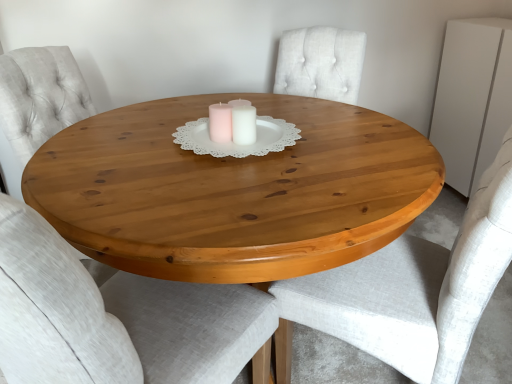
Where is `free space in front of white matte candle at center`? free space in front of white matte candle at center is located at coordinates (230, 157).